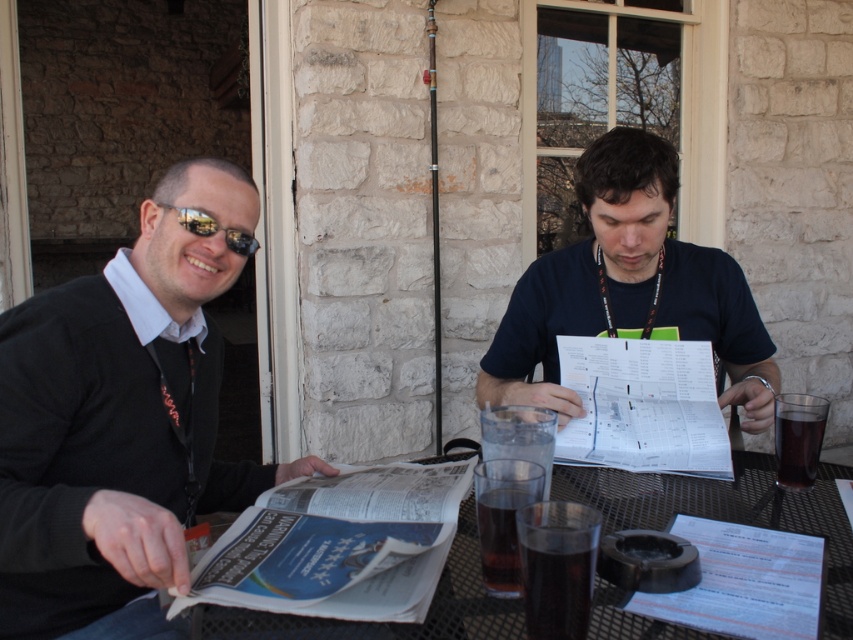
Looking at this image, you are a photographer trying to capture a candid shot of both the white paper at center and the matte black sunglasses at upper left. Since you want to ensure both are in frame, can you tell me which object is positioned to the right of the other?

The white paper at center is to the right of matte black sunglasses at upper left, so when framing your shot, position the matte black sunglasses at upper left on the left side of the frame and the white paper at center to its right to include both in the photo.

You are a photographer trying to capture a closeup of the white paper at center without the matte black sunglasses at upper left appearing in the frame. Is this possible based on their positions?

The white paper at center has a greater height compared to the matte black sunglasses at upper left, so it is possible to capture a closeup of the white paper at center without the matte black sunglasses at upper left appearing in the frame by adjusting the camera angle to focus on the higher positioned paper while avoiding the lower sunglasses.

You are a server at the cafe and need to place a new drink order on the table. Based on the scene, can you safely place the drink on the metal mesh table at center without it spilling over the dark brown liquid at table center?

The metal mesh table at center is not as tall as the dark brown liquid at table center, meaning the liquid is taller than the table. This suggests the liquid is in a cup or glass that stands above the table surface. Therefore, placing a new drink on the table should be safe as long as there is space around the existing cup.